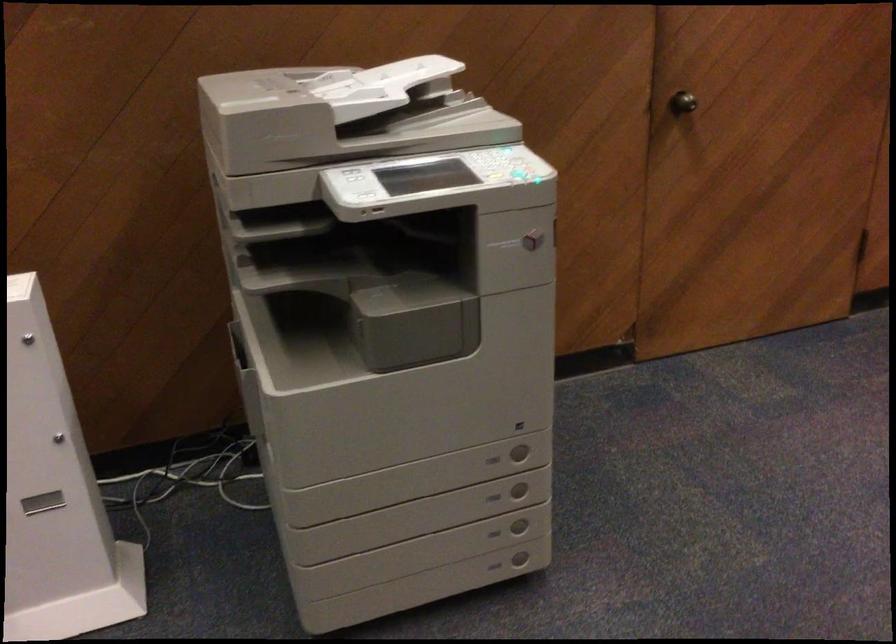
The height and width of the screenshot is (644, 896). What do you see at coordinates (437, 86) in the screenshot?
I see `the printer access handle` at bounding box center [437, 86].